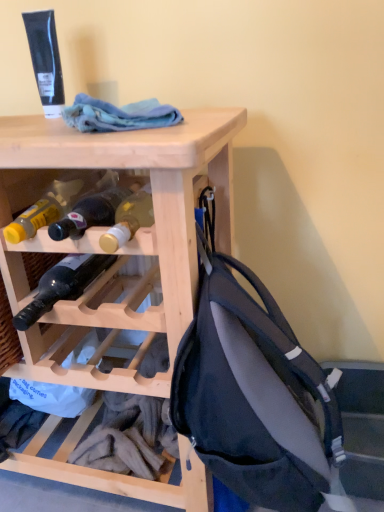
At what (x,y) coordinates should I click in order to perform the action: click on vacant space situated on the left part of blue cotton cloth at upper center. Please return your answer as a coordinate pair (x, y). The width and height of the screenshot is (384, 512). Looking at the image, I should click on (33, 130).